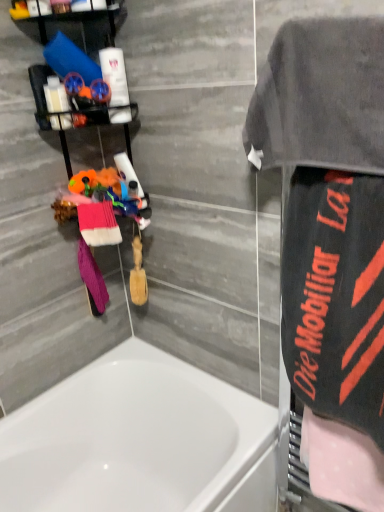
Question: From a real-world perspective, is matte plastic bottles at upper left, the 1th toiletry from the left, under white glossy bathtub at lower left?

Choices:
 (A) yes
 (B) no

Answer: (B)

Question: Could you tell me if matte plastic bottles at upper left, the 2th toiletry when ordered from right to left, is facing white glossy bathtub at lower left?

Choices:
 (A) yes
 (B) no

Answer: (B)

Question: Is matte plastic bottles at upper left, the 2th toiletry when ordered from right to left, far from white glossy bathtub at lower left?

Choices:
 (A) yes
 (B) no

Answer: (A)

Question: Considering the relative sizes of matte plastic bottles at upper left, the 1th toiletry from the left, and white glossy bathtub at lower left in the image provided, is matte plastic bottles at upper left, the 1th toiletry from the left, shorter than white glossy bathtub at lower left?

Choices:
 (A) no
 (B) yes

Answer: (B)

Question: Considering the relative sizes of matte plastic bottles at upper left, the 2th toiletry when ordered from right to left, and white glossy bathtub at lower left in the image provided, is matte plastic bottles at upper left, the 2th toiletry when ordered from right to left, bigger than white glossy bathtub at lower left?

Choices:
 (A) yes
 (B) no

Answer: (B)

Question: From a real-world perspective, is pink polka dot towel at right, the 1th beach towel when ordered from right to left, above or below white glossy lotion at upper left, the 2th toiletry positioned from the left?

Choices:
 (A) above
 (B) below

Answer: (B)

Question: Considering their positions, is pink polka dot towel at right, acting as the 5th beach towel starting from the left, located in front of or behind white glossy lotion at upper left, positioned as the 1th toiletry in right-to-left order?

Choices:
 (A) behind
 (B) front

Answer: (B)

Question: In terms of width, does pink polka dot towel at right, acting as the 5th beach towel starting from the left, look wider or thinner when compared to white glossy lotion at upper left, positioned as the 1th toiletry in right-to-left order?

Choices:
 (A) wide
 (B) thin

Answer: (A)

Question: Does point (322, 430) appear closer or farther from the camera than point (119, 119)?

Choices:
 (A) farther
 (B) closer

Answer: (B)

Question: From the image's perspective, is white glossy bathtub at lower left above or below gray terry cloth towel at upper right?

Choices:
 (A) above
 (B) below

Answer: (B)

Question: In terms of width, does white glossy bathtub at lower left look wider or thinner when compared to gray terry cloth towel at upper right?

Choices:
 (A) thin
 (B) wide

Answer: (B)

Question: Do you think white glossy bathtub at lower left is within gray terry cloth towel at upper right, or outside of it?

Choices:
 (A) inside
 (B) outside

Answer: (B)

Question: From a real-world perspective, is white glossy bathtub at lower left above or below gray terry cloth towel at upper right?

Choices:
 (A) above
 (B) below

Answer: (B)

Question: From a real-world perspective, is pink polka dot towel at right, the 1th beach towel when ordered from right to left, positioned above or below gray terry cloth towel at upper right?

Choices:
 (A) above
 (B) below

Answer: (B)

Question: In terms of height, does pink polka dot towel at right, acting as the 5th beach towel starting from the left, look taller or shorter compared to gray terry cloth towel at upper right?

Choices:
 (A) tall
 (B) short

Answer: (B)